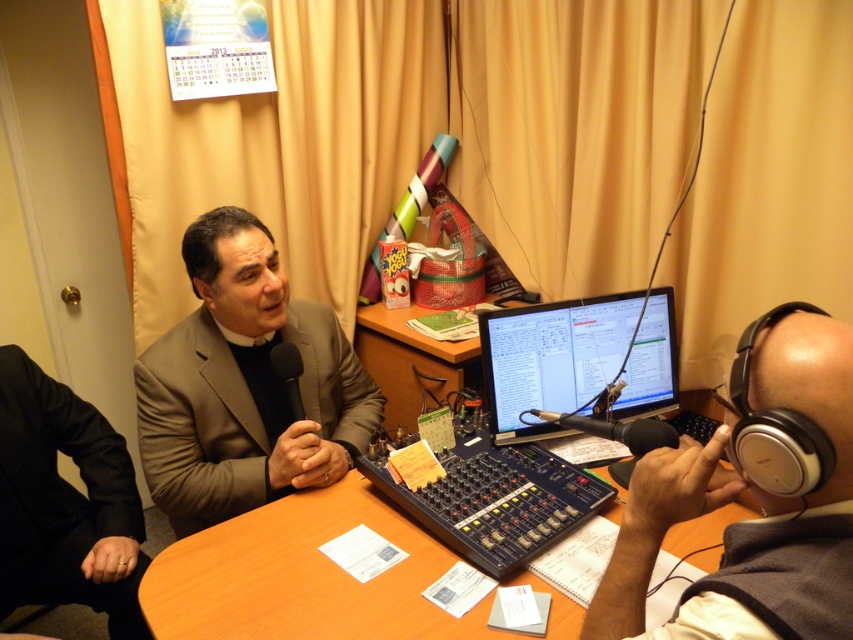
Question: Which of these objects is positioned farthest from the white matte headphones at upper right?

Choices:
 (A) wooden desk at center
 (B) black fabric business suit at lower left

Answer: (B)

Question: Does matte brown suit at center have a larger size compared to wooden desk at center?

Choices:
 (A) yes
 (B) no

Answer: (A)

Question: Is matte brown suit at center smaller than wooden round table at center?

Choices:
 (A) no
 (B) yes

Answer: (A)

Question: Which point appears closest to the camera in this image?

Choices:
 (A) (323, 424)
 (B) (451, 358)

Answer: (A)

Question: Is black fabric business suit at lower left to the left of wooden desk at center from the viewer's perspective?

Choices:
 (A) yes
 (B) no

Answer: (A)

Question: Among these objects, which one is nearest to the camera?

Choices:
 (A) matte brown suit at center
 (B) wooden round table at center
 (C) white matte headphones at upper right

Answer: (C)